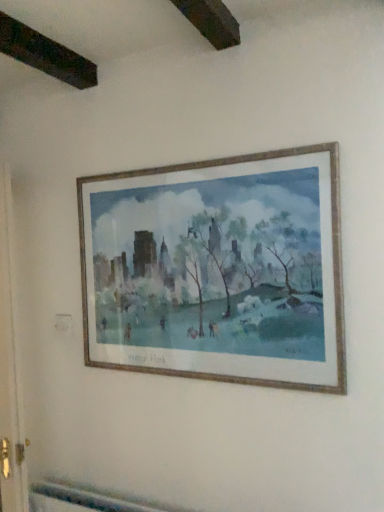
Where is `wooden frame at center`? wooden frame at center is located at coordinates (218, 269).

This screenshot has width=384, height=512. What do you see at coordinates (218, 269) in the screenshot?
I see `wooden frame at center` at bounding box center [218, 269].

What are the coordinates of `wooden frame at center` in the screenshot? It's located at (218, 269).